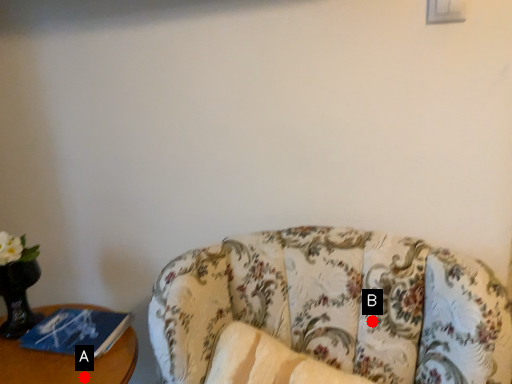
Question: Two points are circled on the image, labeled by A and B beside each circle. Among these points, which one is farthest from the camera?

Choices:
 (A) A is further
 (B) B is further

Answer: (A)